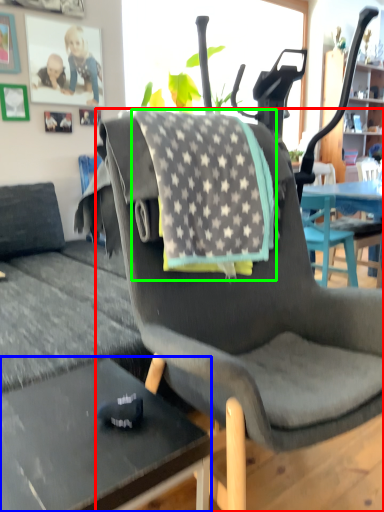
Question: Based on their relative distances, which object is farther from chair (highlighted by a red box)? Choose from desk (highlighted by a blue box) and blanket (highlighted by a green box).

Choices:
 (A) desk
 (B) blanket

Answer: (A)